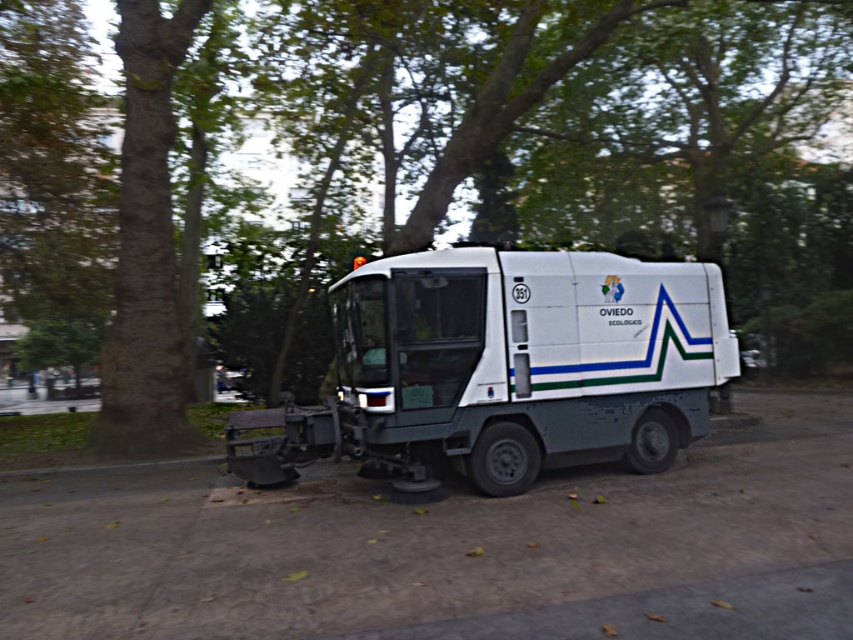
You are a pedestrian standing at the edge of the paved area and see the green leafy tree at center and the white matte tow truck at center. Which object is closer to you?

The green leafy tree at center is closer to you because the white matte tow truck at center is positioned behind it.

You are driving a car and need to park between the green leafy tree at center and the white matte tow truck at center. Which side of the tow truck should you park on?

You should park to the left side of the white matte tow truck at center because the green leafy tree at center is already located to the left of the tow truck.